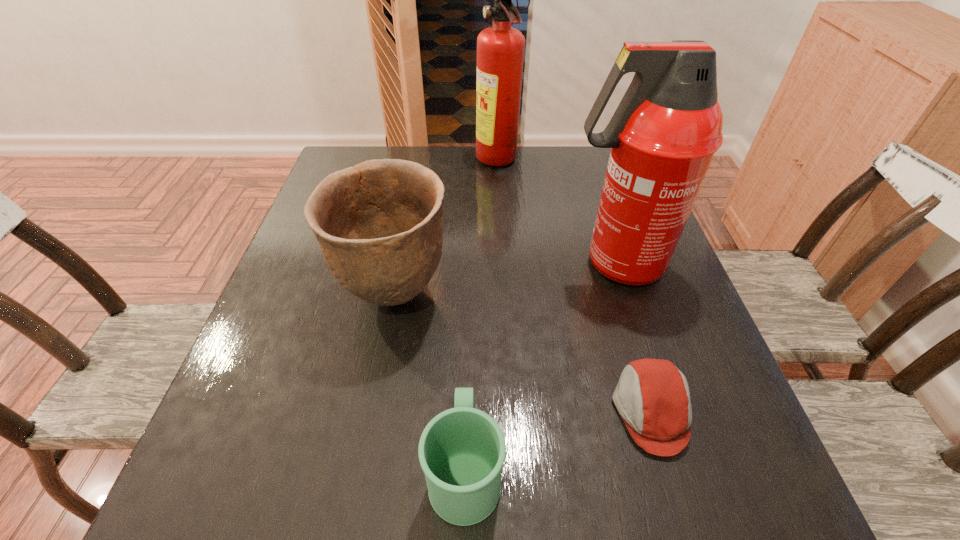
The height and width of the screenshot is (540, 960). What are the coordinates of `object that is at the near edge` in the screenshot? It's located at (462, 450).

The width and height of the screenshot is (960, 540). Find the location of `object at the left edge`. object at the left edge is located at coordinates pos(379,224).

Where is `fire extinguisher present at the right edge`? The image size is (960, 540). fire extinguisher present at the right edge is located at coordinates (663, 135).

Find the location of `cap positioned at the right edge`. cap positioned at the right edge is located at coordinates (652, 396).

The width and height of the screenshot is (960, 540). In order to click on blank space at the far edge in this screenshot , I will do `click(548, 157)`.

At what (x,y) coordinates should I click in order to perform the action: click on blank space at the near edge. Please return your answer as a coordinate pair (x, y). Looking at the image, I should click on (561, 522).

The image size is (960, 540). In order to click on vacant area at the left edge in this screenshot , I will do `click(282, 373)`.

Locate an element on the screen. vacant region at the right edge is located at coordinates (657, 305).

Image resolution: width=960 pixels, height=540 pixels. Identify the location of vacant space at the far left corner of the desktop. (361, 153).

You are a GUI agent. You are given a task and a screenshot of the screen. Output one action in this format:
    pyautogui.click(x=<x>, y=<y>)
    Task: Click on the free space between the shortest object and the right fire extinguisher
    The height and width of the screenshot is (540, 960).
    Given the screenshot: What is the action you would take?
    pyautogui.click(x=633, y=338)